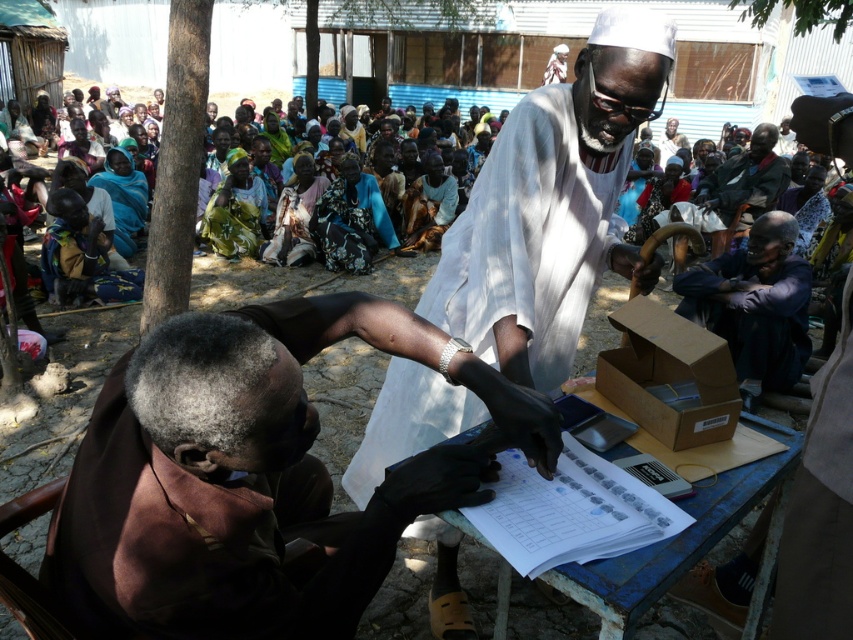
You are standing in the outdoor medical examination area. There is a point at coordinates point (196, 515). Can you reach this point without moving your feet?

The point (196, 515) is 1.01 meters from the viewer, so yes, you can reach it without moving your feet since it is within arm reach.

You are a photographer setting up a shoot in this scene. You have a camera that can only focus on objects within 3 meters. The brown leather glove at lower left and the purple fabric shirt at lower right are both in your frame. Which object is closer to the camera?

The brown leather glove at lower left is closer to the camera because it is shorter than the purple fabric shirt at lower right, indicating it is nearer.

You are a healthcare worker in a remote area and need to sanitize your tools. You have a brown leather glove at lower left and a white cloth at center. Which item is closer to you if you are standing at the center of the scene?

The white cloth at center is closer to you since it is located at the center of the scene, whereas the brown leather glove at lower left is positioned further away from the center.